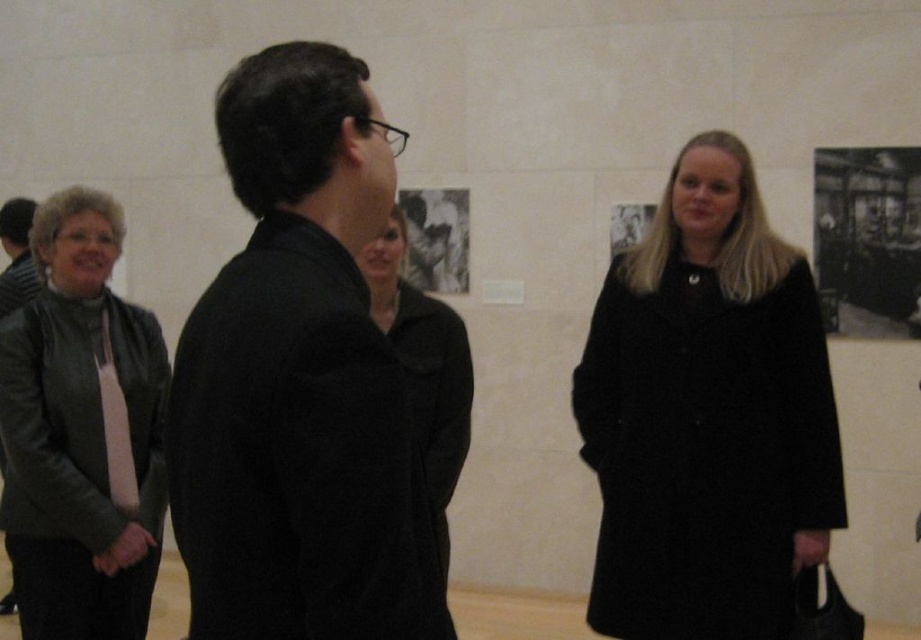
You are an art gallery security guard who needs to ensure that the black matte jacket at center and the matte black coat at center are not overlapping too much to block the view of the artwork. Based on their positions, can you determine which one is covering the other?

The black matte jacket at center is positioned over matte black coat at center, so the black matte jacket at center is covering the matte black coat at center.

You are an art gallery security guard who needs to ensure that the two black items at the center are not blocking the view of the artwork. Since both the black matte jacket at center and the matte black coat at center are in the foreground, which one is smaller and therefore less likely to obstruct the view?

The black matte jacket at center is smaller than the matte black coat at center, so it is less likely to obstruct the view.

You are an art gallery attendant who needs to ensure that all visitors are following the dress code. The dress code requires that no two visitors can be wearing the same color and material combination. You see the black matte jacket at center and the black wool coat at right. Can both visitors wearing these items comply with the dress code?

The black matte jacket at center and the black wool coat at right are both black, but the materials differ between matte and wool. Since the dress code prohibits the same color and material combination, they can comply as their materials are different.